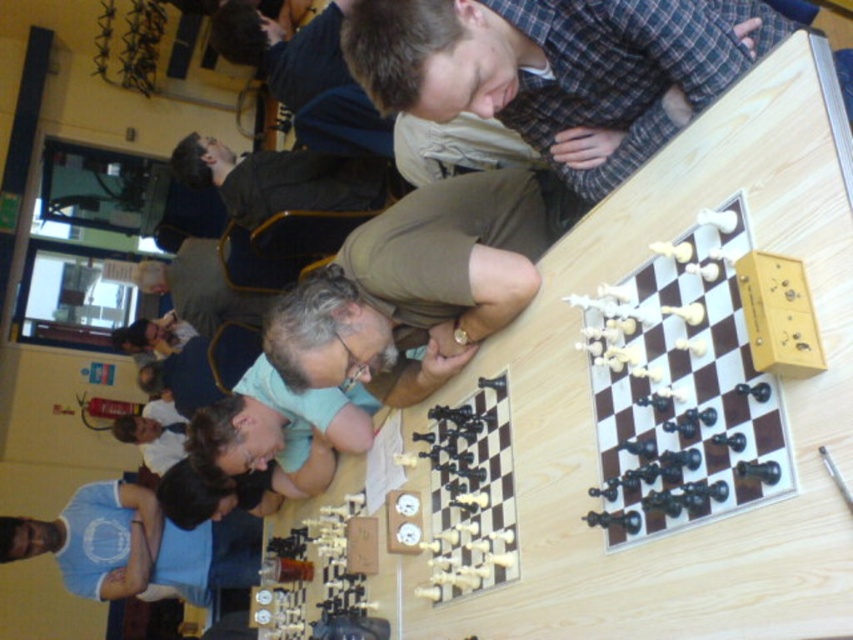
Is blue cotton shirt at lower left below black plastic chess pieces at center?

Correct, blue cotton shirt at lower left is located below black plastic chess pieces at center.

Who is positioned more to the left, blue cotton shirt at lower left or black plastic chess pieces at center?

From the viewer's perspective, blue cotton shirt at lower left appears more on the left side.

What do you see at coordinates (136, 547) in the screenshot? I see `blue cotton shirt at lower left` at bounding box center [136, 547].

Where is `blue cotton shirt at lower left`? blue cotton shirt at lower left is located at coordinates (136, 547).

Is wooden chessboard at upper right positioned in front of blue cotton shirt at lower left?

Yes, wooden chessboard at upper right is closer to the viewer.

Does wooden chessboard at upper right have a greater height compared to blue cotton shirt at lower left?

Incorrect, wooden chessboard at upper right's height is not larger of blue cotton shirt at lower left's.

Is point (643, 314) positioned behind point (16, 525)?

No, it is not.

Where is `wooden chessboard at upper right`? The image size is (853, 640). wooden chessboard at upper right is located at coordinates (682, 388).

What do you see at coordinates (682, 388) in the screenshot? I see `wooden chessboard at upper right` at bounding box center [682, 388].

Between wooden chessboard at upper right and black plastic chess pieces at center, which one is positioned lower?

black plastic chess pieces at center

Which is behind, point (647, 476) or point (462, 481)?

The point (462, 481) is behind.

Locate an element on the screen. Image resolution: width=853 pixels, height=640 pixels. wooden chessboard at upper right is located at coordinates (682, 388).